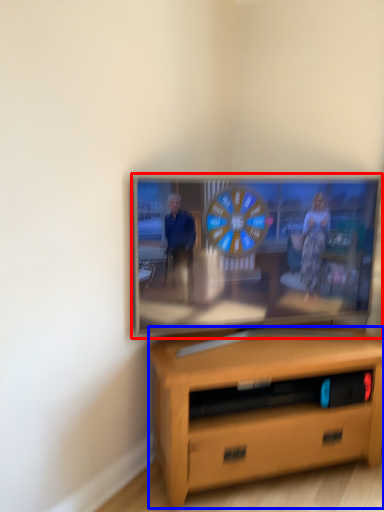
Question: Which object is closer to the camera taking this photo, television (highlighted by a red box) or desk (highlighted by a blue box)?

Choices:
 (A) television
 (B) desk

Answer: (B)